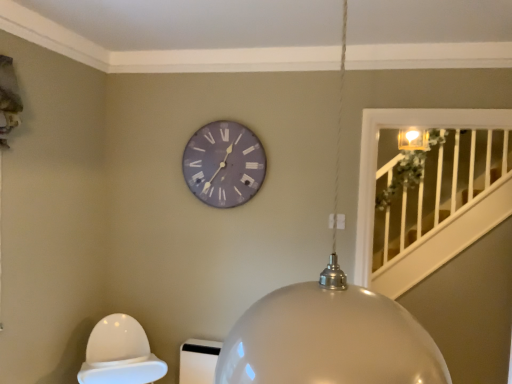
Question: From a real-world perspective, relative to glossy metallic globe at center, is purple matte clock at upper center vertically above or below?

Choices:
 (A) below
 (B) above

Answer: (B)

Question: From the image's perspective, is purple matte clock at upper center above or below glossy metallic globe at center?

Choices:
 (A) below
 (B) above

Answer: (B)

Question: Is purple matte clock at upper center bigger or smaller than glossy metallic globe at center?

Choices:
 (A) small
 (B) big

Answer: (A)

Question: Is glossy metallic globe at center inside the boundaries of purple matte clock at upper center, or outside?

Choices:
 (A) outside
 (B) inside

Answer: (A)

Question: From their relative heights in the image, would you say glossy metallic globe at center is taller or shorter than purple matte clock at upper center?

Choices:
 (A) tall
 (B) short

Answer: (A)

Question: Is glossy metallic globe at center wider or thinner than purple matte clock at upper center?

Choices:
 (A) wide
 (B) thin

Answer: (A)

Question: Considering their positions, is glossy metallic globe at center located in front of or behind purple matte clock at upper center?

Choices:
 (A) front
 (B) behind

Answer: (A)